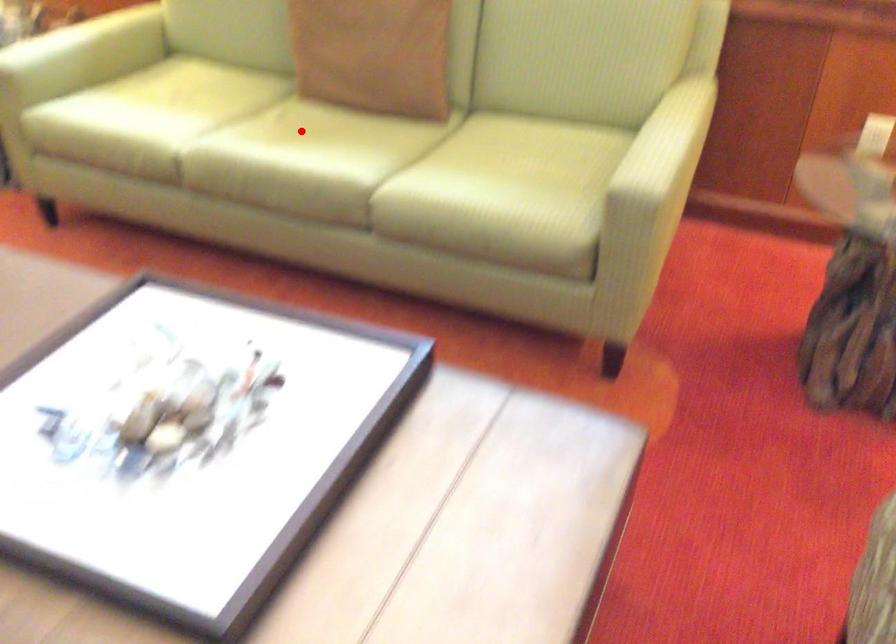
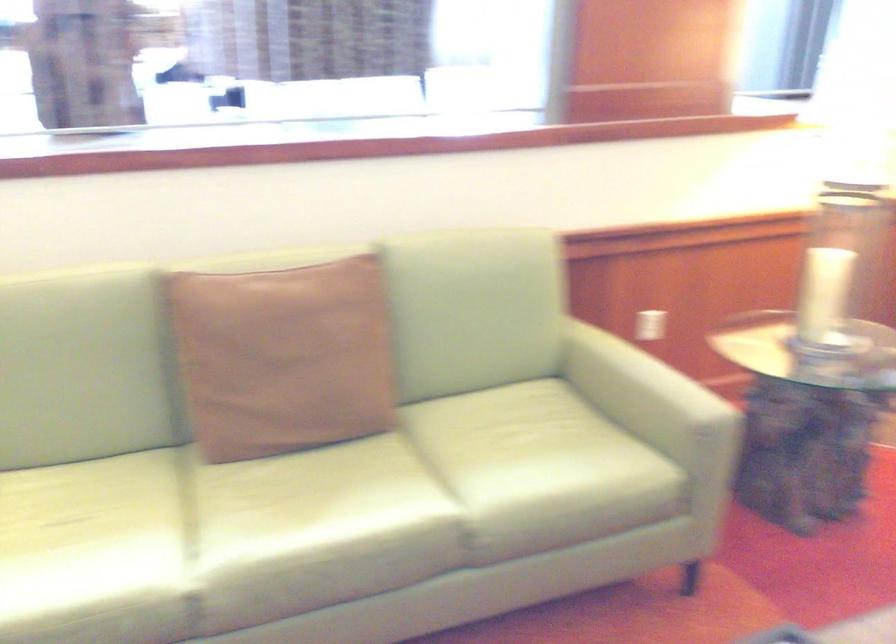
Find the pixel in the second image that matches the highlighted location in the first image.

(299, 498)